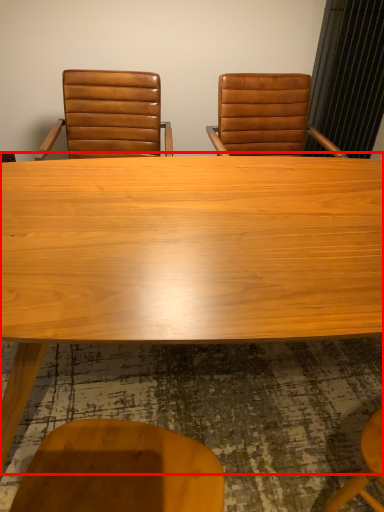
Question: From the image's perspective, considering the relative positions of table (annotated by the red box) and chair in the image provided, where is table (annotated by the red box) located with respect to the staircase?

Choices:
 (A) above
 (B) below

Answer: (B)